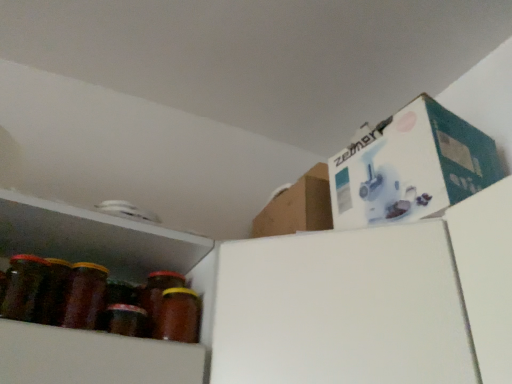
How much space does shiny brown glass jar at left, marked as the 1th bottle in a left-to-right arrangement, occupy vertically?

The height of shiny brown glass jar at left, marked as the 1th bottle in a left-to-right arrangement, is 5.30 inches.

At what (x,y) coordinates should I click in order to perform the action: click on shiny brown glass jar at left, marked as the 1th bottle in a left-to-right arrangement. Please return your answer as a coordinate pair (x, y). The width and height of the screenshot is (512, 384). Looking at the image, I should click on (23, 286).

What do you see at coordinates (23, 286) in the screenshot? I see `shiny brown glass jar at left, which is the 2th bottle in right-to-left order` at bounding box center [23, 286].

The image size is (512, 384). I want to click on brown glass jar at lower left, acting as the first bottle starting from the right, so click(178, 316).

Describe the element at coordinates (178, 316) in the screenshot. The height and width of the screenshot is (384, 512). I see `brown glass jar at lower left, the 2th bottle positioned from the left` at that location.

Where is `shiny brown glass jar at left, marked as the 1th bottle in a left-to-right arrangement`? Image resolution: width=512 pixels, height=384 pixels. shiny brown glass jar at left, marked as the 1th bottle in a left-to-right arrangement is located at coordinates (23, 286).

Between shiny brown glass jar at left, marked as the 1th bottle in a left-to-right arrangement, and brown glass jar at lower left, the 2th bottle positioned from the left, which one appears on the right side from the viewer's perspective?

brown glass jar at lower left, the 2th bottle positioned from the left.

In the image, is shiny brown glass jar at left, marked as the 1th bottle in a left-to-right arrangement, positioned in front of or behind brown glass jar at lower left, the 2th bottle positioned from the left?

shiny brown glass jar at left, marked as the 1th bottle in a left-to-right arrangement, is in front of brown glass jar at lower left, the 2th bottle positioned from the left.

Which is further, [25,297] or [195,304]?

The point [195,304] is more distant.

From the image's perspective, is shiny brown glass jar at left, marked as the 1th bottle in a left-to-right arrangement, located above brown glass jar at lower left, the 2th bottle positioned from the left?

Correct, shiny brown glass jar at left, marked as the 1th bottle in a left-to-right arrangement, appears higher than brown glass jar at lower left, the 2th bottle positioned from the left, in the image.

From a real-world perspective, which is physically above, shiny brown glass jar at left, marked as the 1th bottle in a left-to-right arrangement, or brown glass jar at lower left, the 2th bottle positioned from the left?

In real-world perspective, brown glass jar at lower left, the 2th bottle positioned from the left, is above.

Considering the sizes of objects shiny brown glass jar at left, which is the 2th bottle in right-to-left order, and brown glass jar at lower left, the 2th bottle positioned from the left, in the image provided, who is wider, shiny brown glass jar at left, which is the 2th bottle in right-to-left order, or brown glass jar at lower left, the 2th bottle positioned from the left,?

shiny brown glass jar at left, which is the 2th bottle in right-to-left order.

Considering the relative sizes of shiny brown glass jar at left, which is the 2th bottle in right-to-left order, and brown glass jar at lower left, the 2th bottle positioned from the left, in the image provided, is shiny brown glass jar at left, which is the 2th bottle in right-to-left order, taller than brown glass jar at lower left, the 2th bottle positioned from the left,?

Indeed, shiny brown glass jar at left, which is the 2th bottle in right-to-left order, has a greater height compared to brown glass jar at lower left, the 2th bottle positioned from the left.

In terms of size, does shiny brown glass jar at left, which is the 2th bottle in right-to-left order, appear bigger or smaller than brown glass jar at lower left, the 2th bottle positioned from the left?

Considering their sizes, shiny brown glass jar at left, which is the 2th bottle in right-to-left order, takes up more space than brown glass jar at lower left, the 2th bottle positioned from the left.

Which is correct: shiny brown glass jar at left, marked as the 1th bottle in a left-to-right arrangement, is inside brown glass jar at lower left, acting as the first bottle starting from the right, or outside of it?

The correct answer is: outside.

Is shiny brown glass jar at left, marked as the 1th bottle in a left-to-right arrangement, positioned far away from brown glass jar at lower left, the 2th bottle positioned from the left?

They are positioned close to each other.

Is shiny brown glass jar at left, marked as the 1th bottle in a left-to-right arrangement, facing away from brown glass jar at lower left, acting as the first bottle starting from the right?

shiny brown glass jar at left, marked as the 1th bottle in a left-to-right arrangement, does not have its back to brown glass jar at lower left, acting as the first bottle starting from the right.

What's the angular difference between shiny brown glass jar at left, marked as the 1th bottle in a left-to-right arrangement, and brown glass jar at lower left, acting as the first bottle starting from the right,'s facing directions?

The facing directions of shiny brown glass jar at left, marked as the 1th bottle in a left-to-right arrangement, and brown glass jar at lower left, acting as the first bottle starting from the right, are 0.000132 degrees apart.

At what (x,y) coordinates should I click in order to perform the action: click on bottle on the right of shiny brown glass jar at left, marked as the 1th bottle in a left-to-right arrangement. Please return your answer as a coordinate pair (x, y). The width and height of the screenshot is (512, 384). Looking at the image, I should click on (178, 316).

Which is more to the left, brown glass jar at lower left, acting as the first bottle starting from the right, or shiny brown glass jar at left, marked as the 1th bottle in a left-to-right arrangement?

shiny brown glass jar at left, marked as the 1th bottle in a left-to-right arrangement.

Relative to shiny brown glass jar at left, marked as the 1th bottle in a left-to-right arrangement, is brown glass jar at lower left, acting as the first bottle starting from the right, in front or behind?

brown glass jar at lower left, acting as the first bottle starting from the right, is positioned farther from the viewer than shiny brown glass jar at left, marked as the 1th bottle in a left-to-right arrangement.

Is point (163, 311) closer or farther from the camera than point (0, 314)?

Clearly, point (163, 311) is more distant from the camera than point (0, 314).

From the image's perspective, relative to shiny brown glass jar at left, which is the 2th bottle in right-to-left order, is brown glass jar at lower left, acting as the first bottle starting from the right, above or below?

brown glass jar at lower left, acting as the first bottle starting from the right, is below shiny brown glass jar at left, which is the 2th bottle in right-to-left order.

From a real-world perspective, is brown glass jar at lower left, the 2th bottle positioned from the left, positioned under shiny brown glass jar at left, which is the 2th bottle in right-to-left order, based on gravity?

No, from a real-world perspective, brown glass jar at lower left, the 2th bottle positioned from the left, is not under shiny brown glass jar at left, which is the 2th bottle in right-to-left order.

Is brown glass jar at lower left, acting as the first bottle starting from the right, wider than shiny brown glass jar at left, marked as the 1th bottle in a left-to-right arrangement?

No, brown glass jar at lower left, acting as the first bottle starting from the right, is not wider than shiny brown glass jar at left, marked as the 1th bottle in a left-to-right arrangement.

From their relative heights in the image, would you say brown glass jar at lower left, acting as the first bottle starting from the right, is taller or shorter than shiny brown glass jar at left, marked as the 1th bottle in a left-to-right arrangement?

brown glass jar at lower left, acting as the first bottle starting from the right, is shorter than shiny brown glass jar at left, marked as the 1th bottle in a left-to-right arrangement.

Can you confirm if brown glass jar at lower left, the 2th bottle positioned from the left, is smaller than shiny brown glass jar at left, marked as the 1th bottle in a left-to-right arrangement?

Indeed, brown glass jar at lower left, the 2th bottle positioned from the left, has a smaller size compared to shiny brown glass jar at left, marked as the 1th bottle in a left-to-right arrangement.

Would you say brown glass jar at lower left, acting as the first bottle starting from the right, is outside shiny brown glass jar at left, marked as the 1th bottle in a left-to-right arrangement?

brown glass jar at lower left, acting as the first bottle starting from the right, is positioned outside shiny brown glass jar at left, marked as the 1th bottle in a left-to-right arrangement.

Is brown glass jar at lower left, the 2th bottle positioned from the left, positioned far away from shiny brown glass jar at left, marked as the 1th bottle in a left-to-right arrangement?

Actually, brown glass jar at lower left, the 2th bottle positioned from the left, and shiny brown glass jar at left, marked as the 1th bottle in a left-to-right arrangement, are a little close together.

Does brown glass jar at lower left, acting as the first bottle starting from the right, turn towards shiny brown glass jar at left, marked as the 1th bottle in a left-to-right arrangement?

No, brown glass jar at lower left, acting as the first bottle starting from the right, is not facing towards shiny brown glass jar at left, marked as the 1th bottle in a left-to-right arrangement.

How many degrees apart are the facing directions of brown glass jar at lower left, the 2th bottle positioned from the left, and shiny brown glass jar at left, which is the 2th bottle in right-to-left order?

0.000132 degrees separate the facing orientations of brown glass jar at lower left, the 2th bottle positioned from the left, and shiny brown glass jar at left, which is the 2th bottle in right-to-left order.

How much distance is there between brown glass jar at lower left, acting as the first bottle starting from the right, and shiny brown glass jar at left, marked as the 1th bottle in a left-to-right arrangement?

brown glass jar at lower left, acting as the first bottle starting from the right, is 24.24 centimeters from shiny brown glass jar at left, marked as the 1th bottle in a left-to-right arrangement.

This screenshot has height=384, width=512. I want to click on bottle located behind the shiny brown glass jar at left, marked as the 1th bottle in a left-to-right arrangement, so click(x=178, y=316).

Where is `bottle below the brown glass jar at lower left, the 2th bottle positioned from the left (from a real-world perspective)`? The image size is (512, 384). bottle below the brown glass jar at lower left, the 2th bottle positioned from the left (from a real-world perspective) is located at coordinates (23, 286).

Image resolution: width=512 pixels, height=384 pixels. Identify the location of bottle that appears in front of the brown glass jar at lower left, acting as the first bottle starting from the right. (23, 286).